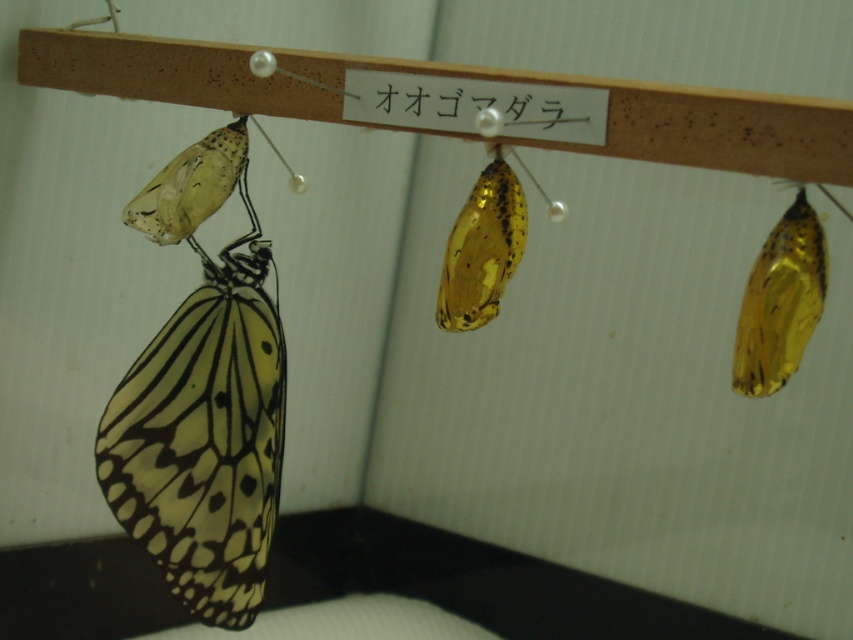
Question: Which object is closer to the camera taking this photo?

Choices:
 (A) translucent amber chrysalis at right
 (B) translucent amber chrysalis at center
 (C) yellow translucent butterfly at lower left
 (D) translucent yellow pupa at center

Answer: (A)

Question: In this image, where is yellow translucent butterfly at lower left located relative to translucent amber chrysalis at right?

Choices:
 (A) right
 (B) left

Answer: (B)

Question: Is translucent yellow pupa at center bigger than translucent amber chrysalis at center?

Choices:
 (A) yes
 (B) no

Answer: (A)

Question: Does yellow translucent butterfly at lower left appear over translucent amber chrysalis at center?

Choices:
 (A) no
 (B) yes

Answer: (A)

Question: Which point is closer to the camera?

Choices:
 (A) translucent amber chrysalis at right
 (B) translucent amber chrysalis at center
 (C) translucent yellow pupa at center
 (D) yellow translucent butterfly at lower left

Answer: (A)

Question: Which point is closer to the camera?

Choices:
 (A) translucent amber chrysalis at center
 (B) translucent yellow pupa at center
 (C) yellow translucent butterfly at lower left

Answer: (B)